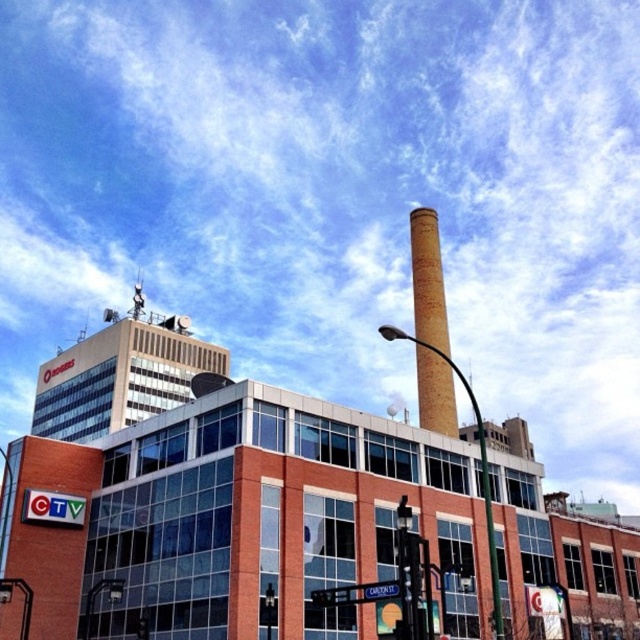
Question: Can you confirm if brick chimney at center is positioned to the right of brick pole at center?

Choices:
 (A) yes
 (B) no

Answer: (B)

Question: Does brick chimney at center appear on the left side of brick pole at center?

Choices:
 (A) yes
 (B) no

Answer: (A)

Question: Which object is farther from the camera taking this photo?

Choices:
 (A) brick pole at center
 (B) brick chimney at center

Answer: (B)

Question: From the image, what is the correct spatial relationship of brick chimney at center in relation to brick pole at center?

Choices:
 (A) right
 (B) left

Answer: (B)

Question: Among these objects, which one is farthest from the camera?

Choices:
 (A) brick chimney at center
 (B) brick pole at center

Answer: (A)

Question: Which object is farther from the camera taking this photo?

Choices:
 (A) brick pole at center
 (B) brick chimney at center

Answer: (B)